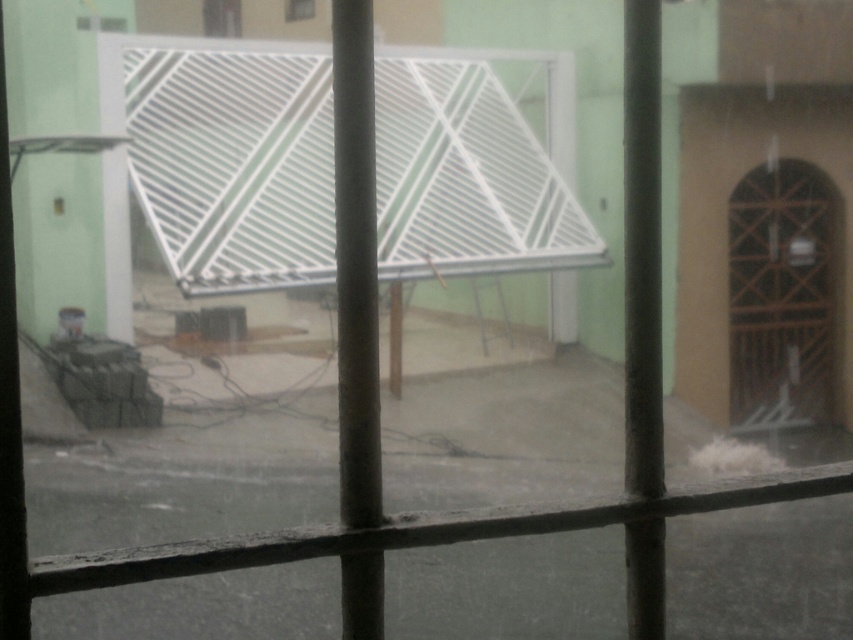
Can you confirm if white matte grill at center is thinner than brown wooden door at right?

No.

Is white matte grill at center to the right of brown wooden door at right from the viewer's perspective?

No, white matte grill at center is not to the right of brown wooden door at right.

Is point (489, 88) less distant than point (757, 349)?

That is False.

You are a GUI agent. You are given a task and a screenshot of the screen. Output one action in this format:
    pyautogui.click(x=<x>, y=<y>)
    Task: Click on the white matte grill at center
    
    Given the screenshot: What is the action you would take?
    pyautogui.click(x=233, y=161)